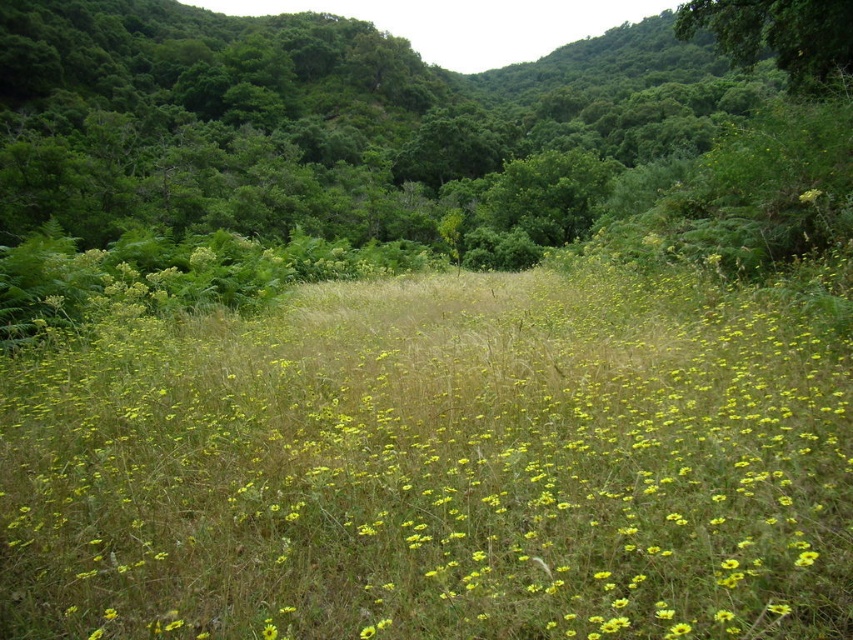
Question: Is green leafy tree at upper right below yellow matte flower at center?

Choices:
 (A) yes
 (B) no

Answer: (B)

Question: From the image, what is the correct spatial relationship of yellow grass at center in relation to green leafy tree at upper right?

Choices:
 (A) above
 (B) below

Answer: (B)

Question: Based on their relative distances, which object is nearer to the green leafy tree at upper right?

Choices:
 (A) yellow grass at center
 (B) yellow matte flower at center

Answer: (B)

Question: Which point is closer to the camera taking this photo?

Choices:
 (A) (764, 28)
 (B) (804, 202)
 (C) (431, 464)

Answer: (C)

Question: Does yellow grass at center have a lesser width compared to green leafy tree at upper right?

Choices:
 (A) no
 (B) yes

Answer: (B)

Question: Which object is positioned farthest from the yellow matte flower at center?

Choices:
 (A) green leafy tree at upper right
 (B) yellow grass at center

Answer: (A)